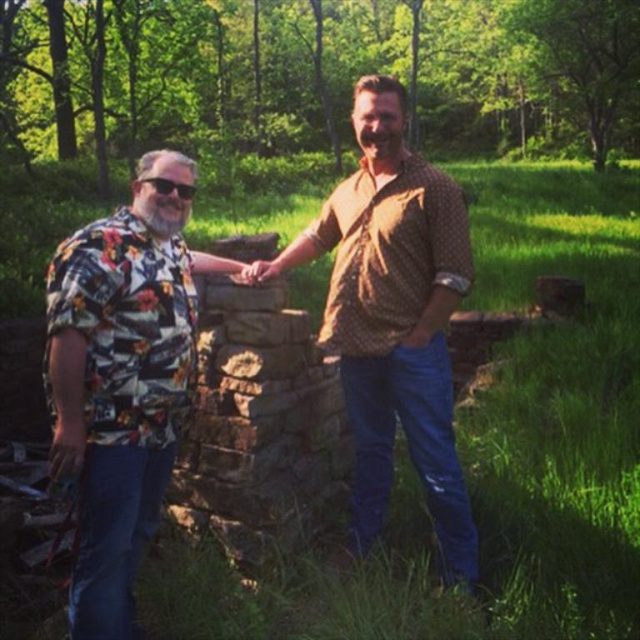
Between floral print shirt at left and brown dotted shirt at center, which one has more height?

With more height is brown dotted shirt at center.

Does floral print shirt at left have a smaller size compared to brown dotted shirt at center?

Correct, floral print shirt at left occupies less space than brown dotted shirt at center.

Is point (147, 224) positioned behind point (465, 240)?

No, (147, 224) is in front of (465, 240).

Locate an element on the screen. floral print shirt at left is located at coordinates (122, 380).

Locate an element on the screen. Image resolution: width=640 pixels, height=640 pixels. floral-patterned shirt at center is located at coordinates (394, 317).

Image resolution: width=640 pixels, height=640 pixels. Identify the location of floral-patterned shirt at center. (394, 317).

Who is lower down, floral-patterned shirt at center or brown dotted shirt at center?

floral-patterned shirt at center is below.

Can you confirm if floral-patterned shirt at center is wider than brown dotted shirt at center?

Indeed, floral-patterned shirt at center has a greater width compared to brown dotted shirt at center.

Image resolution: width=640 pixels, height=640 pixels. In order to click on floral-patterned shirt at center in this screenshot , I will do `click(394, 317)`.

The image size is (640, 640). Identify the location of floral-patterned shirt at center. (394, 317).